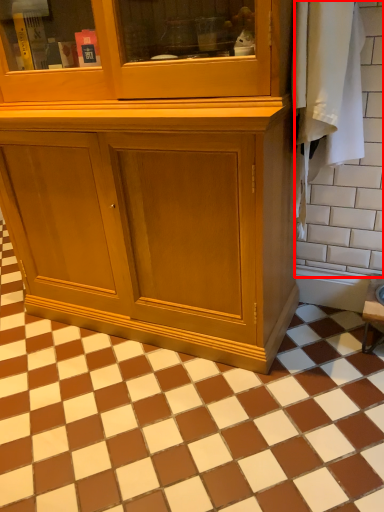
Question: Considering the relative positions of ceramic tile (annotated by the red box) and ceramic tile in the image provided, where is ceramic tile (annotated by the red box) located with respect to the staircase?

Choices:
 (A) left
 (B) right

Answer: (B)